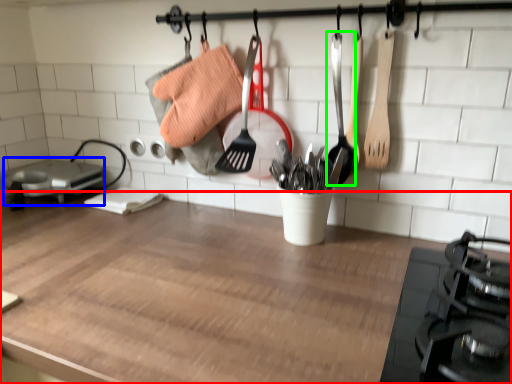
Question: Which object is positioned closest to countertop (highlighted by a red box)? Select from appliance (highlighted by a blue box) and utensil (highlighted by a green box).

Choices:
 (A) appliance
 (B) utensil

Answer: (B)